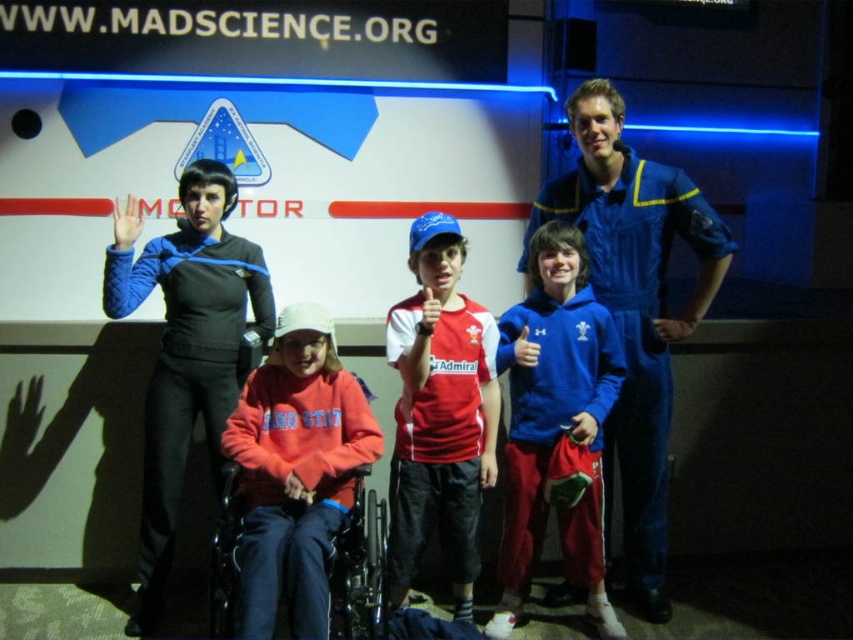
Which is above, blue jumpsuit at right or red cotton shirt at center?

blue jumpsuit at right is above.

Does blue jumpsuit at right come behind red cotton shirt at center?

Yes, blue jumpsuit at right is behind red cotton shirt at center.

Where is `blue jumpsuit at right`? The width and height of the screenshot is (853, 640). blue jumpsuit at right is located at coordinates (634, 308).

Is black fabric uniform at left positioned at the back of blue fleece at center?

That is False.

This screenshot has width=853, height=640. Identify the location of black fabric uniform at left. (186, 348).

Does point (157, 552) lie in front of point (569, 385)?

No, (157, 552) is further to viewer.

In order to click on black fabric uniform at left in this screenshot , I will do `click(186, 348)`.

Is blue fleece at center above red cotton shirt at center?

No, blue fleece at center is not above red cotton shirt at center.

Is blue fleece at center to the left of red cotton shirt at center from the viewer's perspective?

Incorrect, blue fleece at center is not on the left side of red cotton shirt at center.

Locate an element on the screen. blue fleece at center is located at coordinates (556, 422).